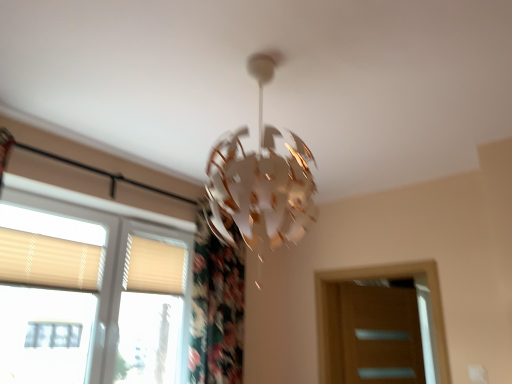
Question: Considering the relative sizes of beige fabric shutter at lower left, positioned as the 2th shutter in left-to-right order, and beige fabric shutter at left, acting as the second shutter starting from the right, in the image provided, is beige fabric shutter at lower left, positioned as the 2th shutter in left-to-right order, bigger than beige fabric shutter at left, acting as the second shutter starting from the right,?

Choices:
 (A) no
 (B) yes

Answer: (A)

Question: Is beige fabric shutter at lower left, the second shutter positioned from the front, oriented away from beige fabric shutter at left, the 1th shutter viewed from the front?

Choices:
 (A) no
 (B) yes

Answer: (A)

Question: Is beige fabric shutter at lower left, the second shutter positioned from the front, shorter than beige fabric shutter at left, the 1th shutter viewed from the left?

Choices:
 (A) yes
 (B) no

Answer: (B)

Question: Does beige fabric shutter at lower left, positioned as the 2th shutter in left-to-right order, have a greater width compared to beige fabric shutter at left, acting as the second shutter starting from the right?

Choices:
 (A) yes
 (B) no

Answer: (A)

Question: Can you confirm if beige fabric shutter at lower left, positioned as the 2th shutter in left-to-right order, is smaller than beige fabric shutter at left, the 2th shutter when ordered from back to front?

Choices:
 (A) yes
 (B) no

Answer: (A)

Question: In terms of height, does beige fabric shutter at left, the 1th shutter viewed from the left, look taller or shorter compared to beige textured blinds at left?

Choices:
 (A) tall
 (B) short

Answer: (B)

Question: From the image's perspective, is beige fabric shutter at left, acting as the second shutter starting from the right, located above or below beige textured blinds at left?

Choices:
 (A) above
 (B) below

Answer: (A)

Question: Based on their sizes in the image, would you say beige fabric shutter at left, acting as the second shutter starting from the right, is bigger or smaller than beige textured blinds at left?

Choices:
 (A) small
 (B) big

Answer: (A)

Question: Looking at their shapes, would you say beige fabric shutter at left, the 1th shutter viewed from the front, is wider or thinner than beige textured blinds at left?

Choices:
 (A) thin
 (B) wide

Answer: (A)

Question: From the image's perspective, relative to beige fabric shutter at left, the 1th shutter viewed from the left, is beige textured blinds at left above or below?

Choices:
 (A) above
 (B) below

Answer: (B)

Question: Is beige textured blinds at left situated inside beige fabric shutter at left, the 2th shutter when ordered from back to front, or outside?

Choices:
 (A) inside
 (B) outside

Answer: (B)

Question: Visually, is beige textured blinds at left positioned to the left or to the right of beige fabric shutter at left, acting as the second shutter starting from the right?

Choices:
 (A) left
 (B) right

Answer: (B)

Question: Is beige textured blinds at left in front of or behind beige fabric shutter at left, acting as the second shutter starting from the right, in the image?

Choices:
 (A) front
 (B) behind

Answer: (A)

Question: From a real-world perspective, is beige fabric shutter at lower left, the second shutter positioned from the front, positioned above or below beige textured blinds at left?

Choices:
 (A) below
 (B) above

Answer: (B)

Question: Considering their positions, is beige fabric shutter at lower left, positioned as the 2th shutter in left-to-right order, located in front of or behind beige textured blinds at left?

Choices:
 (A) behind
 (B) front

Answer: (A)